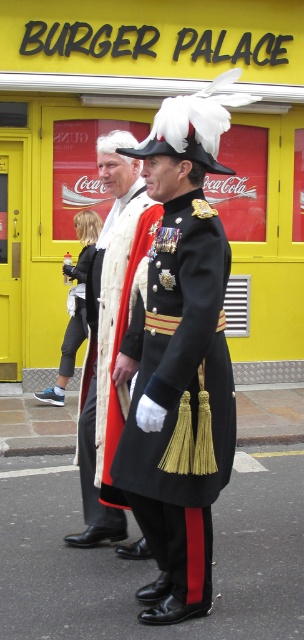
Does matte white scarf at center appear on the left side of matte black coat at center?

No, matte white scarf at center is not to the left of matte black coat at center.

Can you confirm if matte white scarf at center is wider than matte black coat at center?

Indeed, matte white scarf at center has a greater width compared to matte black coat at center.

Where is `matte white scarf at center`? The image size is (304, 640). matte white scarf at center is located at coordinates (109, 330).

Identify the location of white feathered hat at center. The width and height of the screenshot is (304, 640). (193, 125).

Between white feathered hat at center and matte black coat at center, which one is positioned higher?

white feathered hat at center

Does point (200, 115) lie behind point (80, 316)?

No, it is not.

Find the location of a particular element. The width and height of the screenshot is (304, 640). white feathered hat at center is located at coordinates (193, 125).

Does shiny black fabric coat at center appear on the left side of white feathered hat at center?

Correct, you'll find shiny black fabric coat at center to the left of white feathered hat at center.

Does shiny black fabric coat at center have a lesser height compared to white feathered hat at center?

In fact, shiny black fabric coat at center may be taller than white feathered hat at center.

Who is more forward, [149,292] or [193,134]?

Point [193,134]

This screenshot has width=304, height=640. What are the coordinates of `shiny black fabric coat at center` in the screenshot? It's located at (180, 362).